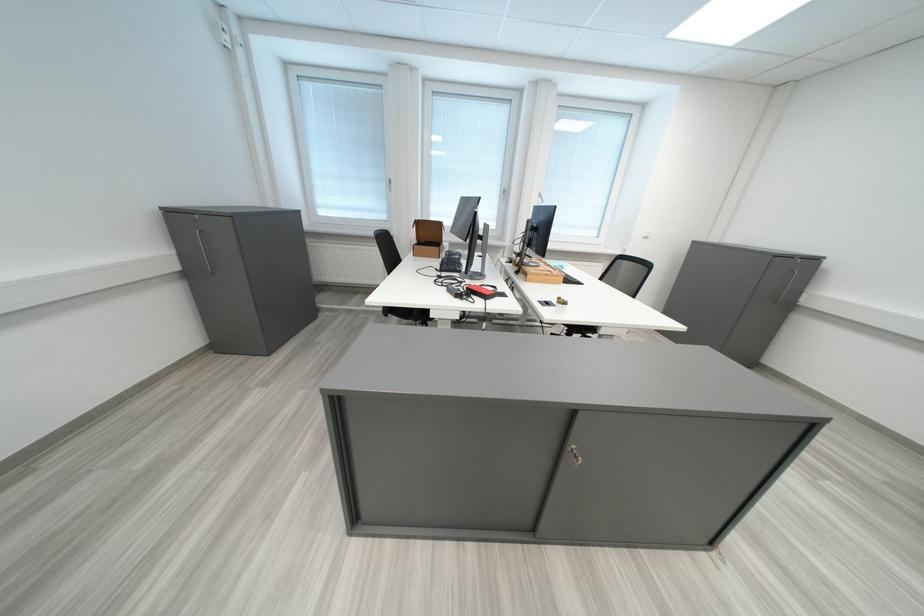
Where would you lift the red power adapter? Please return your answer as a coordinate pair (x, y).

(483, 291)